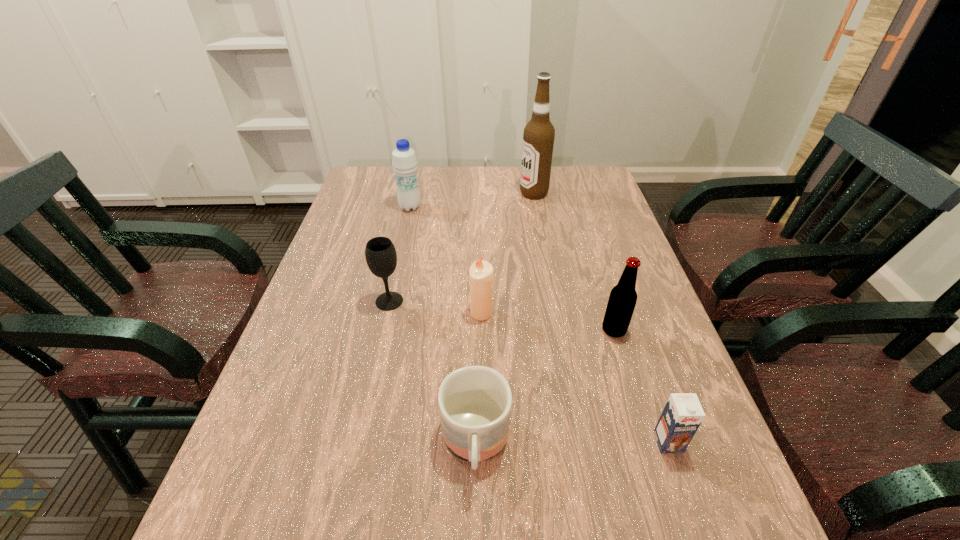
Identify the location of free point between the wineglass and the candle. (435, 307).

Locate an element on the screen. vacant region between the third nearest object and the water bottle is located at coordinates (512, 269).

Where is `unoccupied position between the wineglass and the tallest object`? Image resolution: width=960 pixels, height=540 pixels. unoccupied position between the wineglass and the tallest object is located at coordinates (462, 247).

Locate an element on the screen. The height and width of the screenshot is (540, 960). free space between the mug and the chocolate milk is located at coordinates (572, 443).

At what (x,y) coordinates should I click in order to perform the action: click on the fourth closest object to the candle. Please return your answer as a coordinate pair (x, y). The image size is (960, 540). Looking at the image, I should click on (682, 415).

The height and width of the screenshot is (540, 960). I want to click on object that is the fourth closest to the beer bottle, so click(381, 257).

Identify the location of vacant region that satisfies the following two spatial constraints: 1. on the front side of the wineglass; 2. on the left side of the water bottle. (389, 301).

Locate an element on the screen. This screenshot has height=540, width=960. vacant space that satisfies the following two spatial constraints: 1. on the label of the fifth object from left to right; 2. on the left side of the third nearest object is located at coordinates (559, 330).

Locate an element on the screen. The image size is (960, 540). free location that satisfies the following two spatial constraints: 1. on the front side of the candle; 2. on the left side of the wineglass is located at coordinates (387, 313).

What are the coordinates of `vacant region that satisfies the following two spatial constraints: 1. on the front side of the water bottle; 2. on the right side of the beer bottle` in the screenshot? It's located at (382, 330).